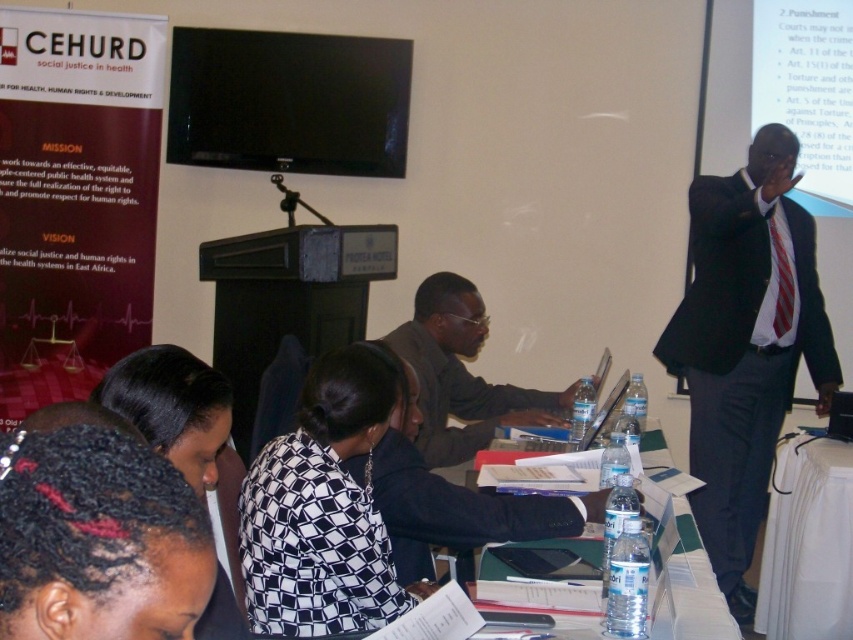
You are attending a formal meeting and need to locate the person wearing the matte gray shirt at center. According to the scene description, where would you find this individual in relation to the table and the podium?

The matte gray shirt at center is located at point (462, 374), which places it at the center of the scene. This means the person is likely seated at the table in the foreground, centrally positioned, rather than near the podium in the background.